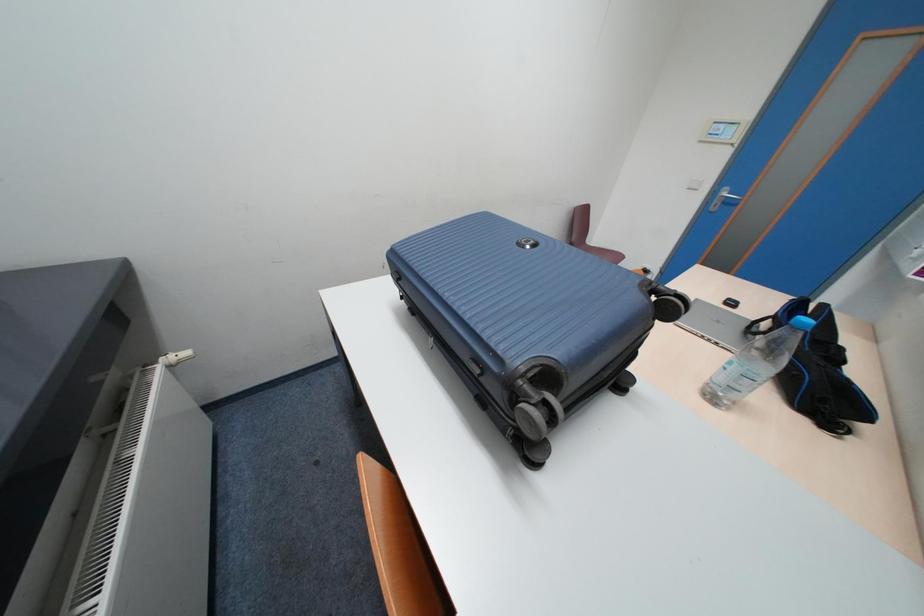
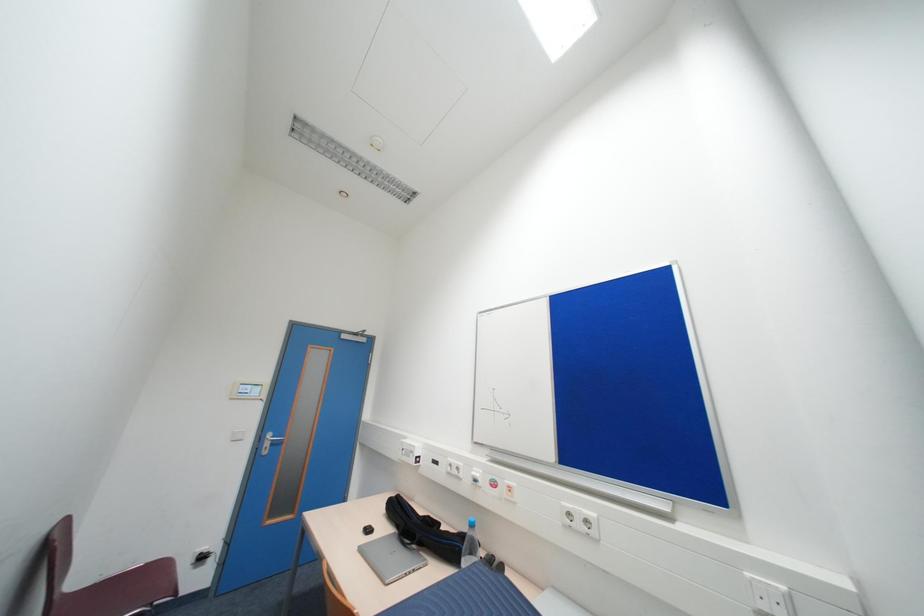
Question: The images are taken continuously from a first-person perspective. In which direction is your viewpoint rotating?

Choices:
 (A) Left
 (B) Right
 (C) Up
 (D) Down

Answer: (B)